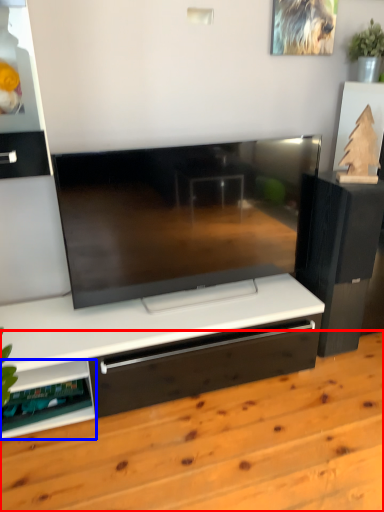
Question: Which object appears closest to the camera in this image, hardwood (highlighted by a red box) or shelf (highlighted by a blue box)?

Choices:
 (A) hardwood
 (B) shelf

Answer: (A)